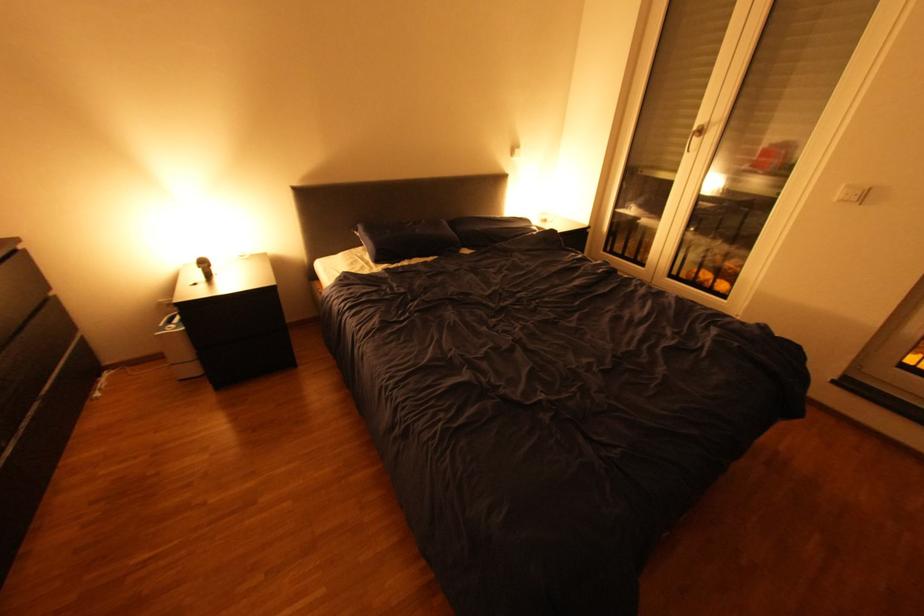
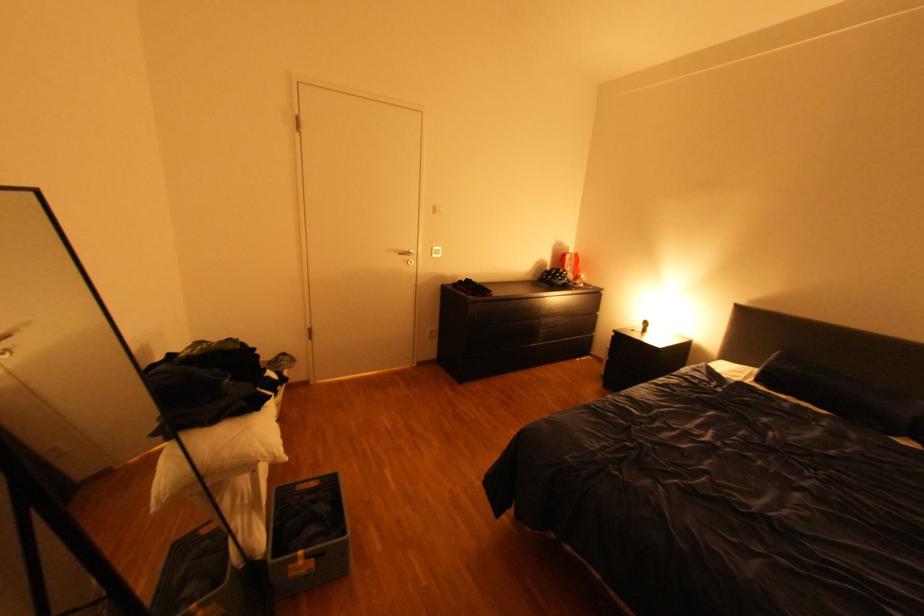
Find the pixel in the second image that matches the point at 395,265 in the first image.

(771, 387)